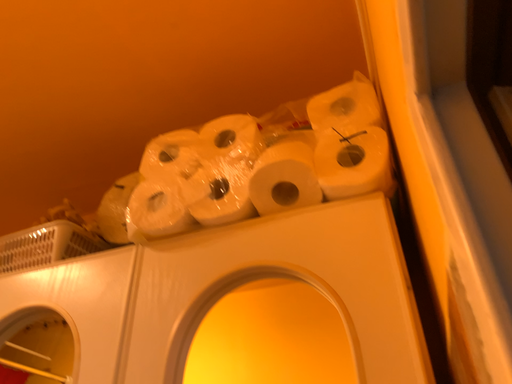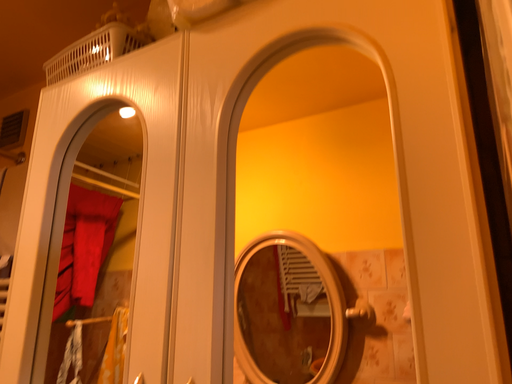
Question: Which way did the camera rotate in the video?

Choices:
 (A) rotated downward
 (B) rotated upward

Answer: (A)